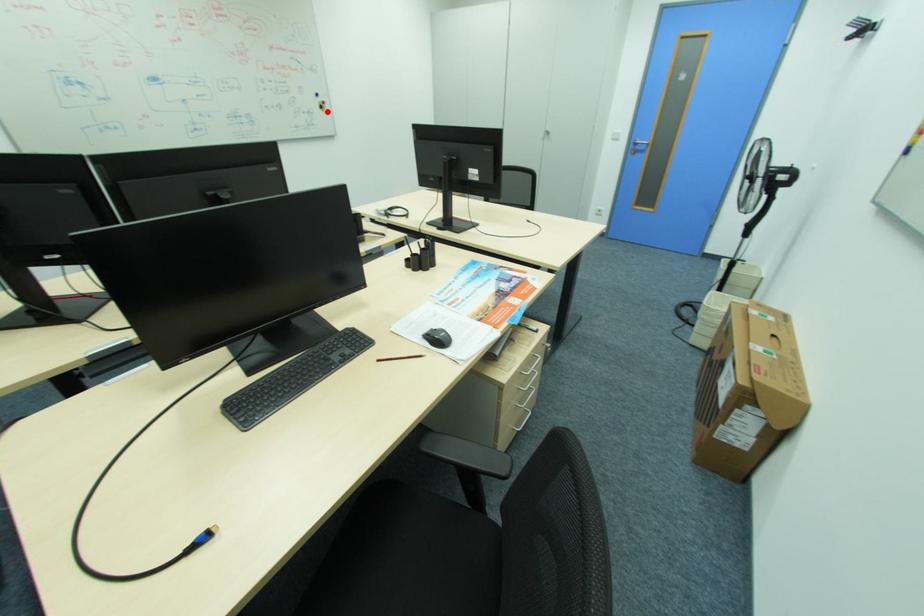
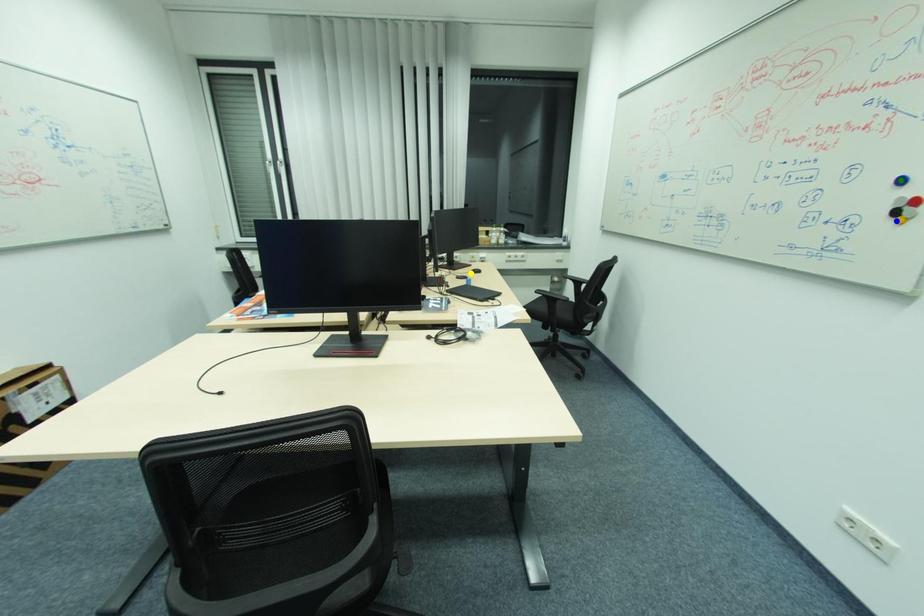
Question: I am providing you with two images of the same scene from different viewpoints. A red point is marked on the first image. You are given multiple points on the second image. Which mark in image 2 goes with the point in image 1?

Choices:
 (A) blue point
 (B) green point
 (C) yellow point

Answer: (A)